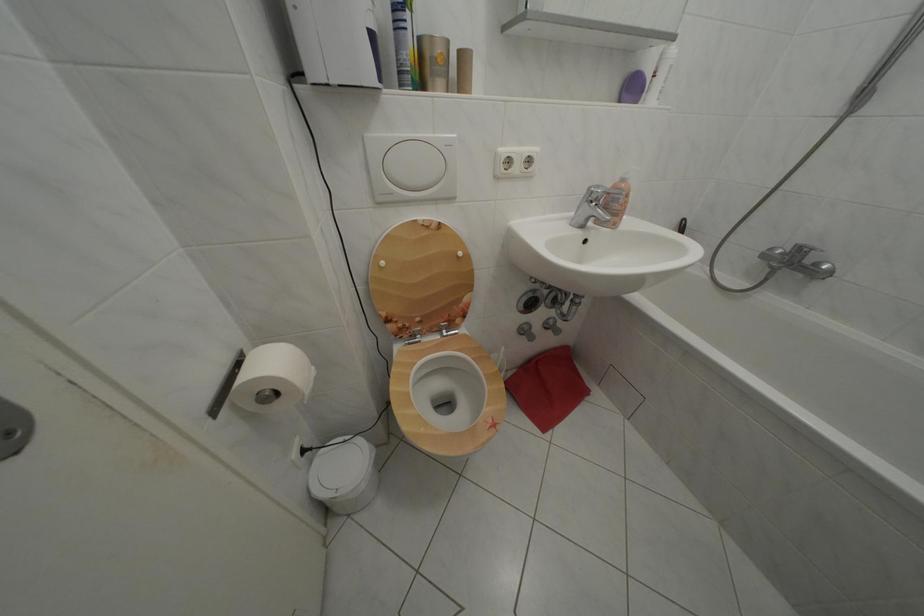
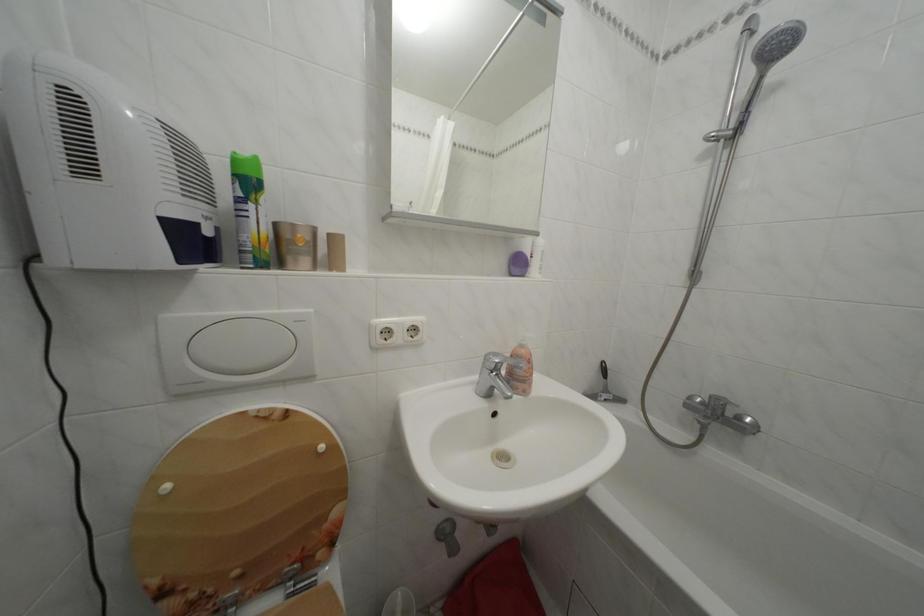
Find the pixel in the second image that matches point (600, 193) in the first image.

(495, 362)